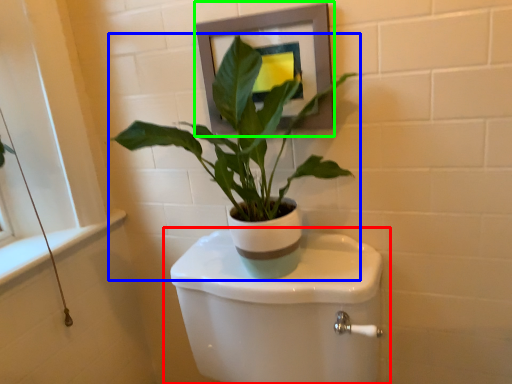
Question: Which object is positioned farthest from toilet (highlighted by a red box)? Select from houseplant (highlighted by a blue box) and picture frame (highlighted by a green box).

Choices:
 (A) houseplant
 (B) picture frame

Answer: (B)